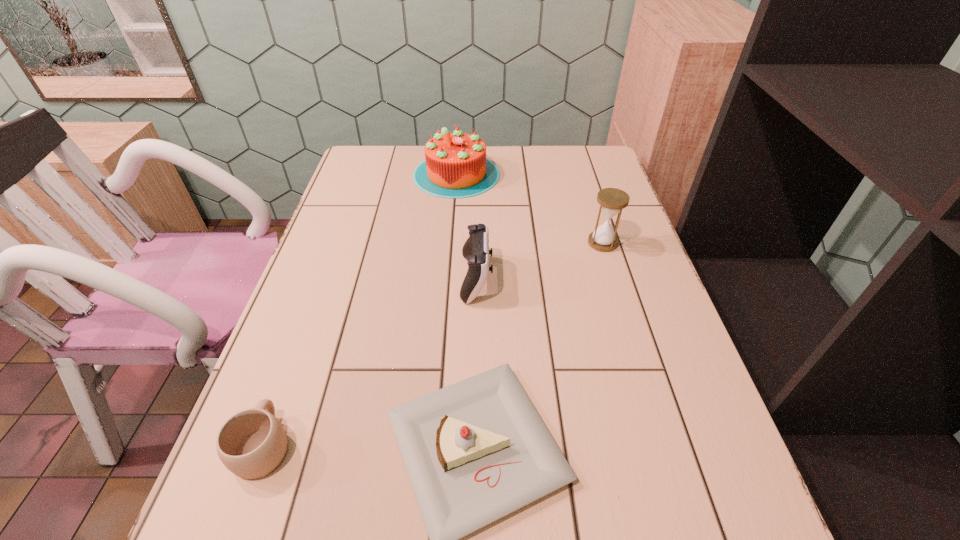
At what (x,y) coordinates should I click in order to perform the action: click on the farther cake. Please return your answer as a coordinate pair (x, y). Looking at the image, I should click on (455, 166).

Identify the location of the taller cake. This screenshot has height=540, width=960. (455, 166).

Identify the location of the second farthest object. (612, 201).

You are a GUI agent. You are given a task and a screenshot of the screen. Output one action in this format:
    pyautogui.click(x=<x>, y=<y>)
    Task: Click on the hourglass
    
    Given the screenshot: What is the action you would take?
    pyautogui.click(x=612, y=201)

In order to click on the third tallest object in this screenshot , I will do `click(476, 251)`.

Image resolution: width=960 pixels, height=540 pixels. In order to click on control in this screenshot , I will do `click(476, 251)`.

In order to click on the leftmost object in this screenshot , I will do `click(252, 443)`.

Find the location of a particular element. The height and width of the screenshot is (540, 960). vacant space positioned on the right of the farthest object is located at coordinates (516, 174).

This screenshot has width=960, height=540. Identify the location of vacant space located 0.130m on the front of the second farthest object. (616, 288).

Where is `free point located 0.320m on the front-facing side of the control`? The image size is (960, 540). free point located 0.320m on the front-facing side of the control is located at coordinates click(x=624, y=279).